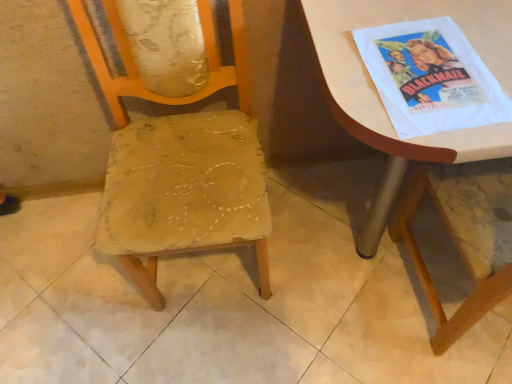
This screenshot has width=512, height=384. I want to click on vacant space to the left of worn fabric chair at center, so click(x=75, y=284).